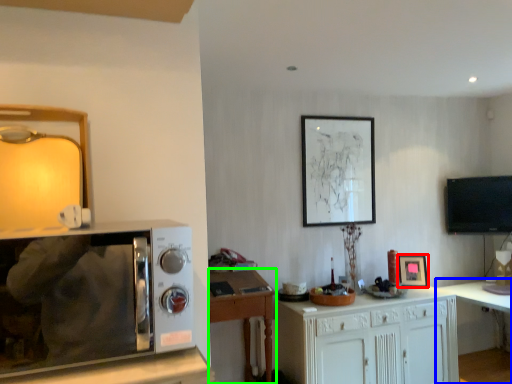
Question: Considering the real-world distances, which object is farthest from picture frame (highlighted by a red box)? table (highlighted by a blue box) or desk (highlighted by a green box)?

Choices:
 (A) table
 (B) desk

Answer: (B)